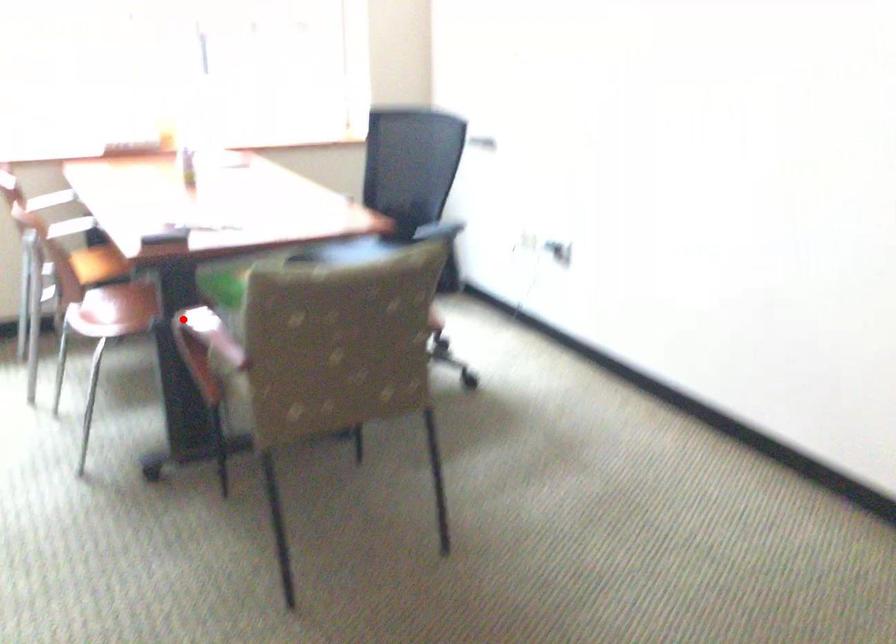
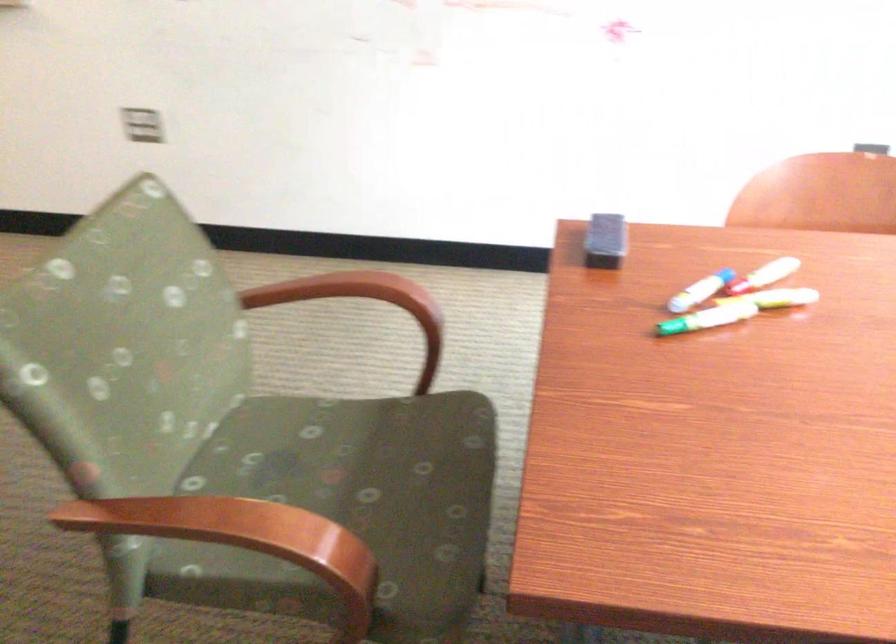
In the second image, find the point that corresponds to the highlighted location in the first image.

(346, 290)